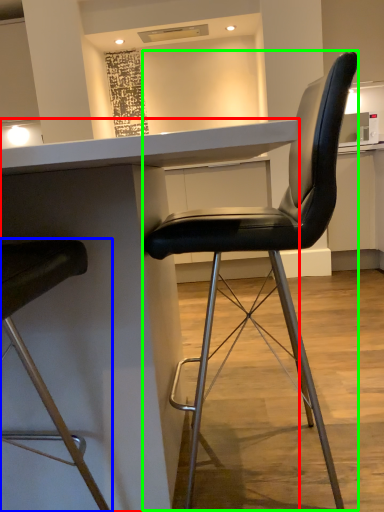
Question: Which object is positioned farthest from table (highlighted by a red box)? Select from chair (highlighted by a blue box) and chair (highlighted by a green box).

Choices:
 (A) chair
 (B) chair

Answer: (B)